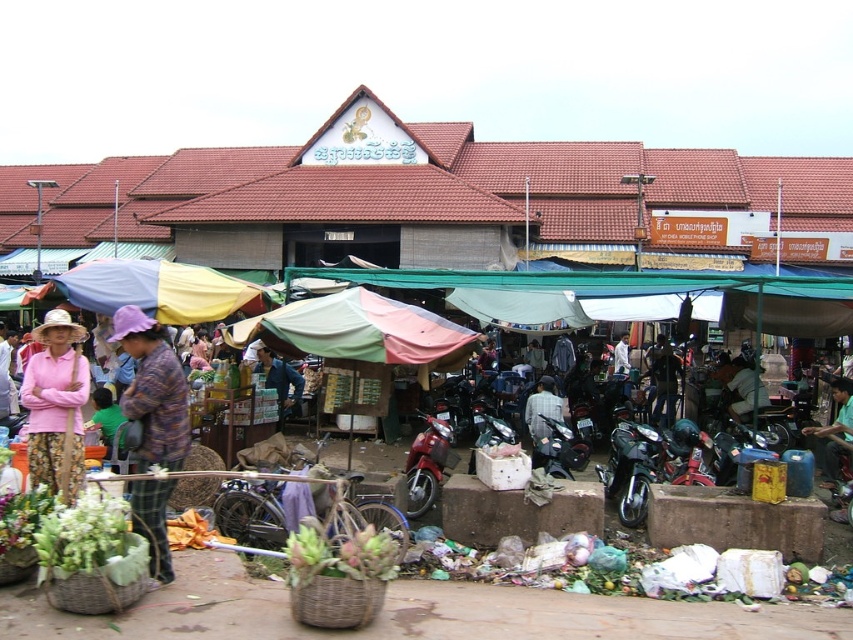
Based on the photo, how distant is purple fabric hat at left from shiny black motorcycle at lower right?

They are 7.41 meters apart.

Does purple fabric hat at left appear on the left side of shiny black motorcycle at lower right?

Yes, purple fabric hat at left is to the left of shiny black motorcycle at lower right.

The width and height of the screenshot is (853, 640). Describe the element at coordinates (154, 390) in the screenshot. I see `purple fabric hat at left` at that location.

Find the location of a particular element. The height and width of the screenshot is (640, 853). purple fabric hat at left is located at coordinates (154, 390).

In the scene shown: Which of these two, dark blue fabric shirt at lower right or shiny black motorcycle at center, stands taller?

shiny black motorcycle at center is taller.

Does dark blue fabric shirt at lower right have a larger size compared to shiny black motorcycle at center?

Actually, dark blue fabric shirt at lower right might be smaller than shiny black motorcycle at center.

Is point (828, 384) positioned after point (560, 444)?

Yes, point (828, 384) is behind point (560, 444).

The image size is (853, 640). I want to click on dark blue fabric shirt at lower right, so click(833, 429).

Which is below, shiny black motorcycle at lower right or shiny black motorcycle at center?

Positioned lower is shiny black motorcycle at lower right.

The height and width of the screenshot is (640, 853). What do you see at coordinates (631, 468) in the screenshot?
I see `shiny black motorcycle at lower right` at bounding box center [631, 468].

The height and width of the screenshot is (640, 853). Find the location of `shiny black motorcycle at lower right`. shiny black motorcycle at lower right is located at coordinates (631, 468).